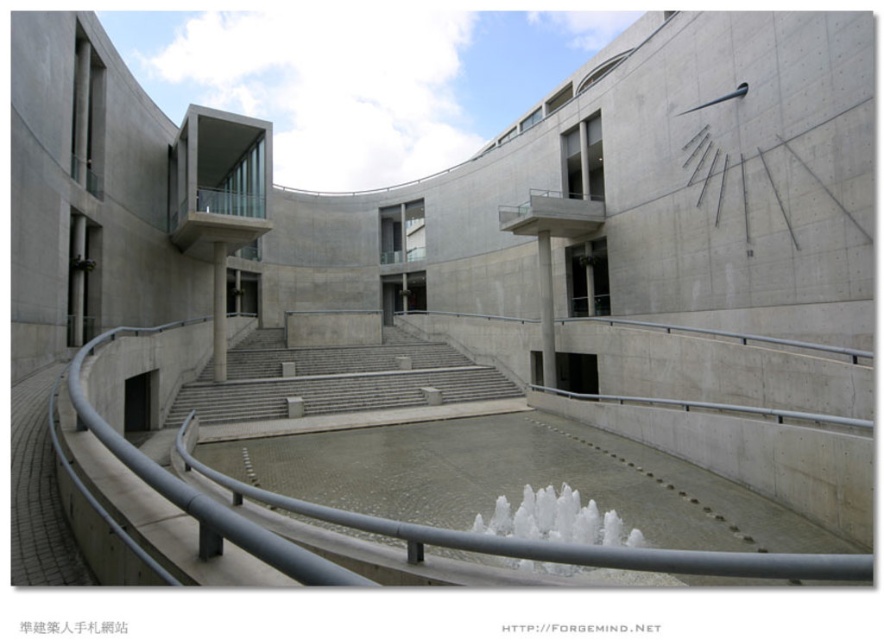
Question: Can you confirm if silver metallic rail at lower center is positioned to the right of gray concrete stairs at center?

Choices:
 (A) no
 (B) yes

Answer: (B)

Question: Among these points, which one is farthest from the camera?

Choices:
 (A) (263, 358)
 (B) (631, 547)
 (C) (348, 515)

Answer: (A)

Question: Is silver metallic rail at lower center bigger than white frothy water at center?

Choices:
 (A) no
 (B) yes

Answer: (B)

Question: Which of these objects is positioned farthest from the white frothy water at center?

Choices:
 (A) silver metallic rail at lower center
 (B) gray concrete stairs at center

Answer: (B)

Question: Observing the image, what is the correct spatial positioning of silver metallic rail at lower center in reference to gray concrete stairs at center?

Choices:
 (A) below
 (B) above

Answer: (A)

Question: Estimate the real-world distances between objects in this image. Which object is closer to the gray concrete stairs at center?

Choices:
 (A) silver metallic rail at lower center
 (B) white frothy water at center

Answer: (A)